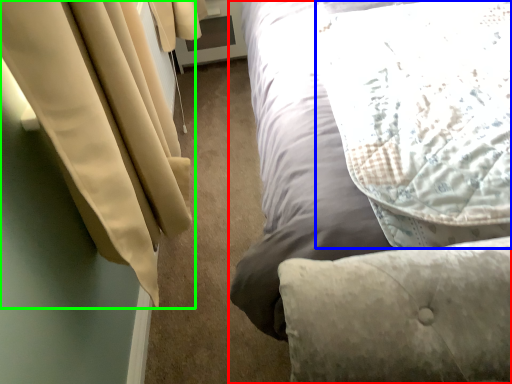
Question: Considering the real-world distances, which object is closest to bed (highlighted by a red box)? pillow (highlighted by a blue box) or curtain (highlighted by a green box).

Choices:
 (A) pillow
 (B) curtain

Answer: (A)